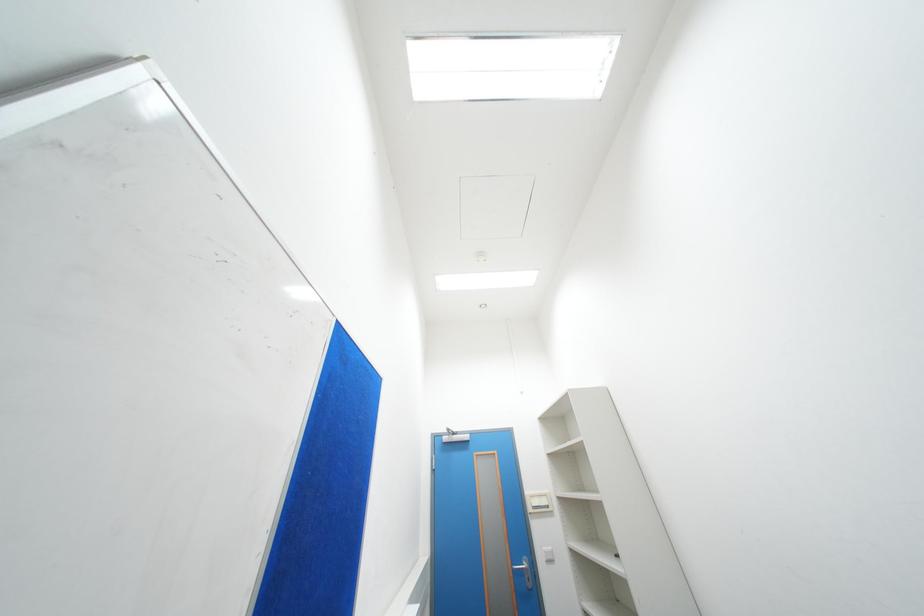
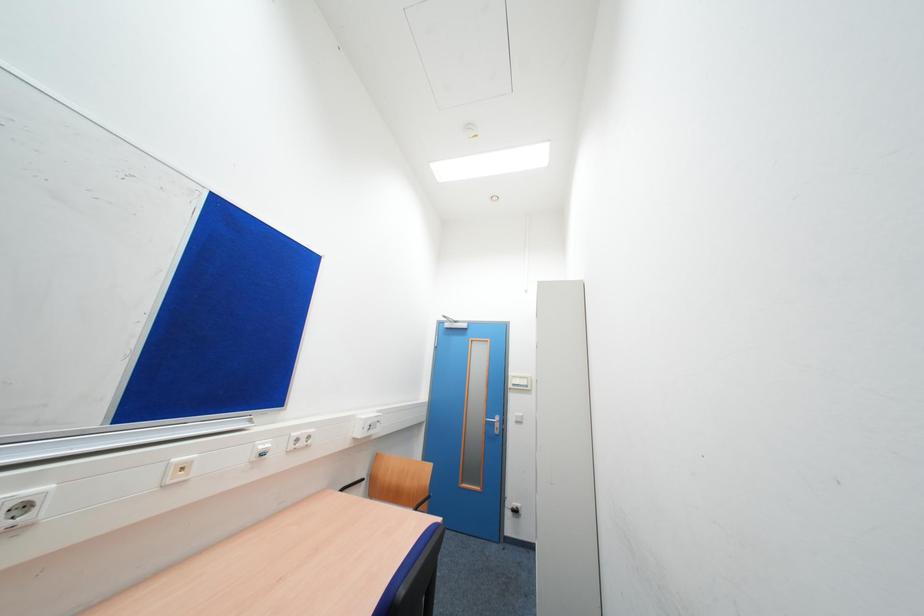
Consider the image. Based on the continuous images, in which direction is the camera rotating?

The camera rotated toward left-down.